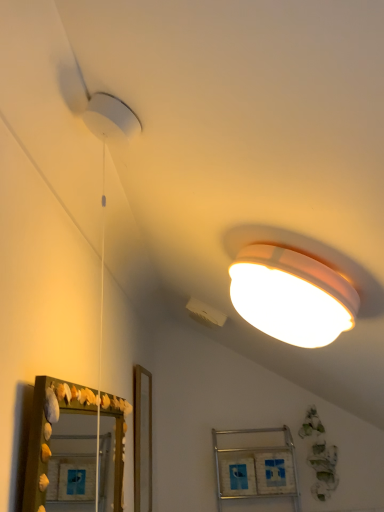
You are a GUI agent. You are given a task and a screenshot of the screen. Output one action in this format:
    pyautogui.click(x=<x>, y=<y>)
    Task: Click on the wooden mirror at lower left
    
    Given the screenshot: What is the action you would take?
    pyautogui.click(x=61, y=448)

What do you see at coordinates (61, 448) in the screenshot?
I see `wooden mirror at lower left` at bounding box center [61, 448].

In order to face wooden mirror at lower left, should I rotate leftwards or rightwards?

Rotate left and turn 12.869 degrees.

This screenshot has width=384, height=512. Describe the element at coordinates (256, 468) in the screenshot. I see `metallic silver cabinet at lower center` at that location.

Find the location of `metallic silver cabinet at lower center`. metallic silver cabinet at lower center is located at coordinates (256, 468).

Find the location of a particular element. This screenshot has height=512, width=384. wooden mirror at lower left is located at coordinates (61, 448).

Is wooden mirror at lower left at the left side of metallic silver cabinet at lower center?

Yes, wooden mirror at lower left is to the left of metallic silver cabinet at lower center.

Based on the photo, which object is closer to the camera, wooden mirror at lower left or metallic silver cabinet at lower center?

wooden mirror at lower left is more forward.

Considering the points (87, 453) and (286, 452), which point is in front, point (87, 453) or point (286, 452)?

Positioned in front is point (286, 452).

From the image's perspective, is wooden mirror at lower left above or below metallic silver cabinet at lower center?

From the image's perspective, wooden mirror at lower left appears above metallic silver cabinet at lower center.

From a real-world perspective, which object stands above the other?

wooden mirror at lower left is physically above.

Which of these two, wooden mirror at lower left or metallic silver cabinet at lower center, is thinner?

wooden mirror at lower left is thinner.

Can you confirm if wooden mirror at lower left is shorter than metallic silver cabinet at lower center?

Yes.

Which of these two, wooden mirror at lower left or metallic silver cabinet at lower center, is smaller?

wooden mirror at lower left.

Is wooden mirror at lower left not within metallic silver cabinet at lower center?

Yes.

Is the surface of wooden mirror at lower left in direct contact with metallic silver cabinet at lower center?

wooden mirror at lower left is not next to metallic silver cabinet at lower center, and they're not touching.

Is wooden mirror at lower left oriented away from metallic silver cabinet at lower center?

No, wooden mirror at lower left's orientation is not away from metallic silver cabinet at lower center.

What's the angular difference between wooden mirror at lower left and metallic silver cabinet at lower center's facing directions?

They differ by 89.6 degrees in their facing directions.

This screenshot has height=512, width=384. Identify the location of cabinet behind the wooden mirror at lower left. (256, 468).

Based on their positions, is metallic silver cabinet at lower center located to the left or right of wooden mirror at lower left?

Clearly, metallic silver cabinet at lower center is on the right of wooden mirror at lower left in the image.

Is metallic silver cabinet at lower center further to camera compared to wooden mirror at lower left?

Yes, the depth of metallic silver cabinet at lower center is greater than that of wooden mirror at lower left.

Does point (233, 493) lie in front of point (73, 470)?

Yes, point (233, 493) is in front of point (73, 470).

From the image's perspective, is metallic silver cabinet at lower center on top of wooden mirror at lower left?

No.

From a real-world perspective, is metallic silver cabinet at lower center positioned above or below wooden mirror at lower left?

From a real-world perspective, metallic silver cabinet at lower center is physically below wooden mirror at lower left.

Considering the relative sizes of metallic silver cabinet at lower center and wooden mirror at lower left in the image provided, is metallic silver cabinet at lower center wider than wooden mirror at lower left?

Yes, metallic silver cabinet at lower center is wider than wooden mirror at lower left.

Does metallic silver cabinet at lower center have a greater height compared to wooden mirror at lower left?

Yes, metallic silver cabinet at lower center is taller than wooden mirror at lower left.

Considering the sizes of objects metallic silver cabinet at lower center and wooden mirror at lower left in the image provided, who is smaller, metallic silver cabinet at lower center or wooden mirror at lower left?

Smaller between the two is wooden mirror at lower left.

Is wooden mirror at lower left surrounded by metallic silver cabinet at lower center?

Definitely not — wooden mirror at lower left is not inside metallic silver cabinet at lower center.

Is metallic silver cabinet at lower center placed right next to wooden mirror at lower left?

No, metallic silver cabinet at lower center is not touching wooden mirror at lower left.

Is metallic silver cabinet at lower center oriented away from wooden mirror at lower left?

metallic silver cabinet at lower center is not turned away from wooden mirror at lower left.

Based on the photo, how different are the orientations of metallic silver cabinet at lower center and wooden mirror at lower left in degrees?

The angular difference between metallic silver cabinet at lower center and wooden mirror at lower left is 89.6 degrees.

At what (x,y) coordinates should I click in order to perform the action: click on cabinet on the right of wooden mirror at lower left. Please return your answer as a coordinate pair (x, y). The width and height of the screenshot is (384, 512). Looking at the image, I should click on (256, 468).

Locate an element on the screen. Image resolution: width=384 pixels, height=512 pixels. mirror in front of the metallic silver cabinet at lower center is located at coordinates (61, 448).

Where is `cabinet directly beneath the wooden mirror at lower left (from a real-world perspective)`? cabinet directly beneath the wooden mirror at lower left (from a real-world perspective) is located at coordinates (256, 468).